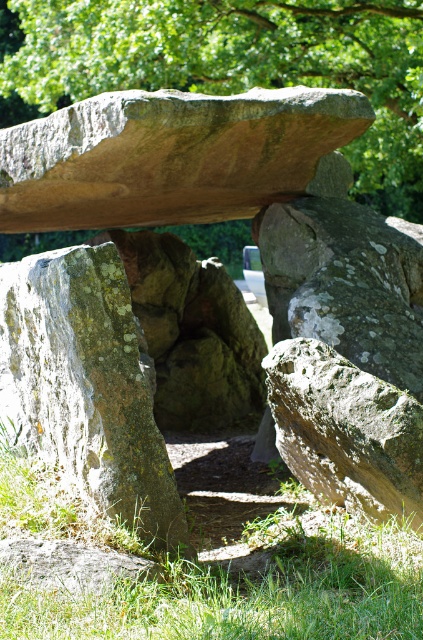
You are standing in front of the dolmen and notice a point marked at coordinates (236, 64). What object is located at this position?

The point at coordinates (236, 64) indicates a green leafy tree at upper center.